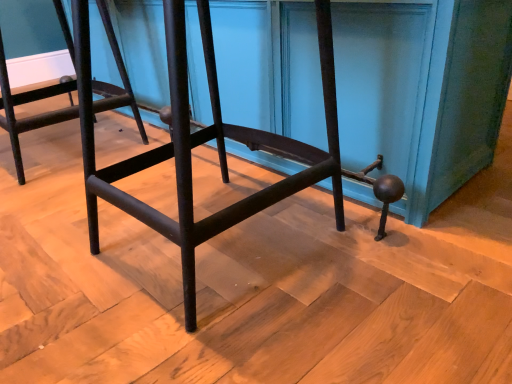
The image size is (512, 384). In order to click on matte black stool at center in this screenshot , I will do `click(203, 143)`.

Describe the element at coordinates (203, 143) in the screenshot. I see `matte black stool at center` at that location.

What are the coordinates of `matte black stool at center` in the screenshot? It's located at (203, 143).